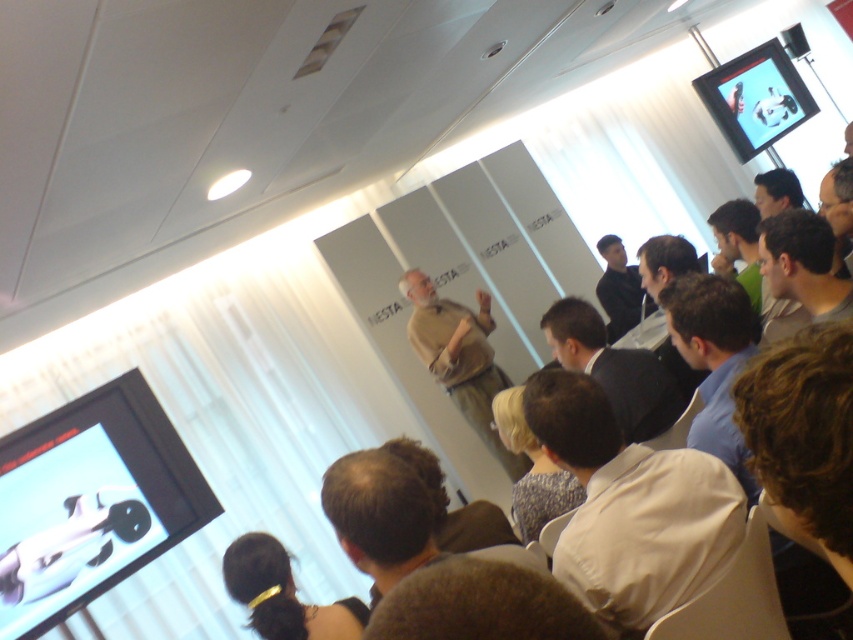
Question: Which object is closer to the camera taking this photo?

Choices:
 (A) matte black screen at upper right
 (B) dark brown leather jacket at upper right

Answer: (B)

Question: Is white cotton shirt at lower center closer to the viewer compared to dark brown leather jacket at upper right?

Choices:
 (A) no
 (B) yes

Answer: (B)

Question: Which point is farther from the camera taking this photo?

Choices:
 (A) (418, 284)
 (B) (743, 65)
 (C) (270, 602)

Answer: (B)

Question: Is matte black screen at lower left positioned behind dark brown hair at lower center?

Choices:
 (A) yes
 (B) no

Answer: (A)

Question: Among these points, which one is farthest from the camera?

Choices:
 (A) (268, 538)
 (B) (749, 92)
 (C) (705, 304)
 (D) (577, 316)

Answer: (B)

Question: Can you confirm if beige fabric shirt at center is positioned below dark brown hair at lower center?

Choices:
 (A) no
 (B) yes

Answer: (A)